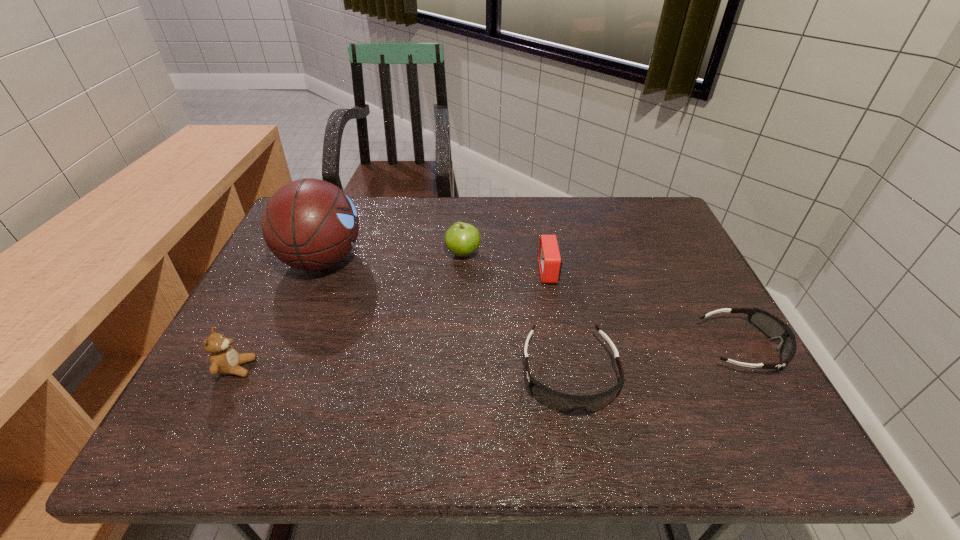
Image resolution: width=960 pixels, height=540 pixels. Find the location of `free point that keeps the goggless evenly spaced on the left`. free point that keeps the goggless evenly spaced on the left is located at coordinates (375, 407).